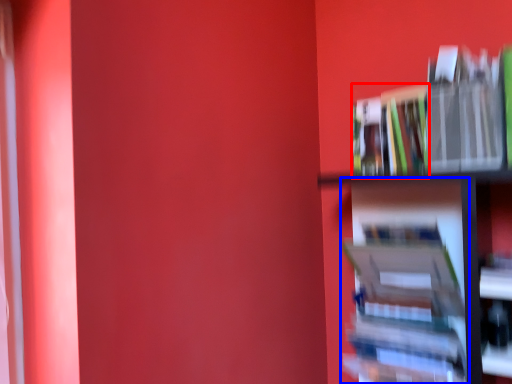
Question: Among these objects, which one is nearest to the camera, book (highlighted by a red box) or book (highlighted by a blue box)?

Choices:
 (A) book
 (B) book

Answer: (B)